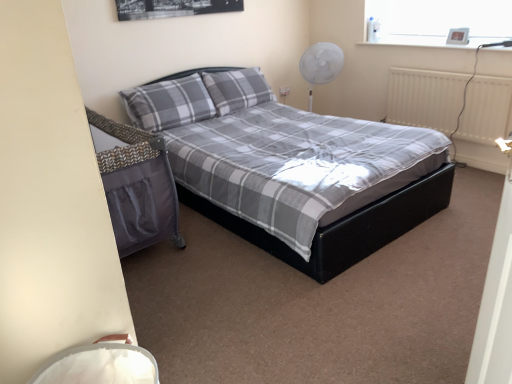
Question: Is metallic digital clock at upper right directly adjacent to white matte radiator at right?

Choices:
 (A) no
 (B) yes

Answer: (A)

Question: From the image's perspective, does metallic digital clock at upper right appear lower than white matte radiator at right?

Choices:
 (A) yes
 (B) no

Answer: (B)

Question: Considering the relative sizes of metallic digital clock at upper right and white matte radiator at right in the image provided, is metallic digital clock at upper right smaller than white matte radiator at right?

Choices:
 (A) yes
 (B) no

Answer: (A)

Question: Can you confirm if metallic digital clock at upper right is taller than white matte radiator at right?

Choices:
 (A) no
 (B) yes

Answer: (A)

Question: Does metallic digital clock at upper right have a lesser width compared to white matte radiator at right?

Choices:
 (A) yes
 (B) no

Answer: (A)

Question: Relative to metallic digital clock at upper right, is matte black bed at center in front or behind?

Choices:
 (A) behind
 (B) front

Answer: (B)

Question: Is matte black bed at center situated inside metallic digital clock at upper right or outside?

Choices:
 (A) inside
 (B) outside

Answer: (B)

Question: From the image's perspective, is matte black bed at center located above or below metallic digital clock at upper right?

Choices:
 (A) below
 (B) above

Answer: (A)

Question: Is matte black bed at center bigger or smaller than metallic digital clock at upper right?

Choices:
 (A) small
 (B) big

Answer: (B)

Question: Is white plastic fan at upper right taller or shorter than matte black bed at center?

Choices:
 (A) short
 (B) tall

Answer: (A)

Question: Is white plastic fan at upper right inside or outside of matte black bed at center?

Choices:
 (A) outside
 (B) inside

Answer: (A)

Question: Would you say white plastic fan at upper right is to the left or to the right of matte black bed at center in the picture?

Choices:
 (A) left
 (B) right

Answer: (B)

Question: Considering the positions of point (x=321, y=61) and point (x=272, y=248), is point (x=321, y=61) closer or farther from the camera than point (x=272, y=248)?

Choices:
 (A) farther
 (B) closer

Answer: (A)

Question: Is point click(452, 41) closer or farther from the camera than point click(500, 102)?

Choices:
 (A) farther
 (B) closer

Answer: (A)

Question: Would you say metallic digital clock at upper right is to the left or to the right of white matte radiator at right in the picture?

Choices:
 (A) left
 (B) right

Answer: (B)